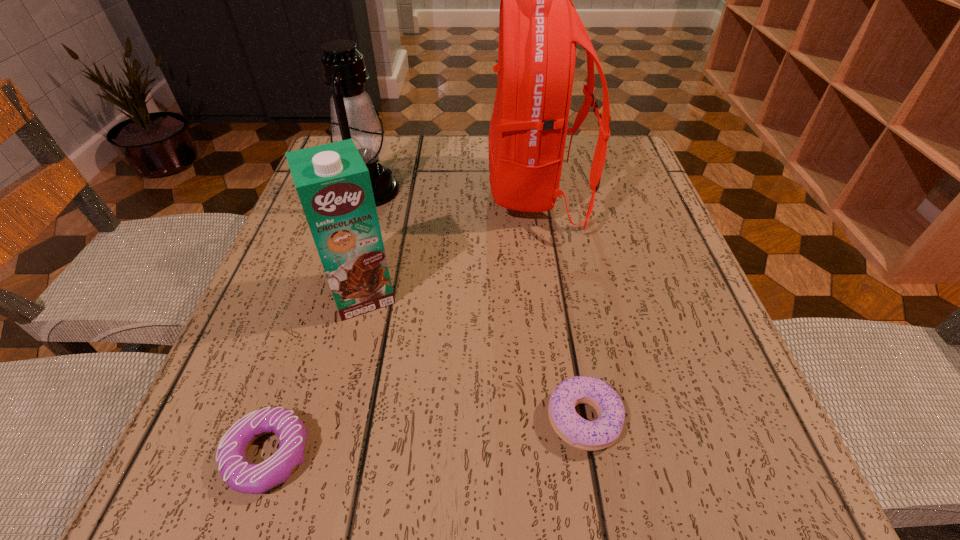
At what (x,y) coordinates should I click in order to perform the action: click on blank space located 0.080m on the left of the right doughnut. Please return your answer as a coordinate pair (x, y). The height and width of the screenshot is (540, 960). Looking at the image, I should click on (488, 419).

The height and width of the screenshot is (540, 960). What are the coordinates of `free space located on the right of the left doughnut` in the screenshot? It's located at (482, 455).

This screenshot has height=540, width=960. I want to click on backpack located at the far edge, so click(x=539, y=26).

You are a GUI agent. You are given a task and a screenshot of the screen. Output one action in this format:
    pyautogui.click(x=<x>, y=<y>)
    Task: Click on the oil lamp that is at the far edge
    This screenshot has height=540, width=960.
    Given the screenshot: What is the action you would take?
    pyautogui.click(x=353, y=115)

What are the coordinates of `oil lamp at the left edge` in the screenshot? It's located at (353, 115).

This screenshot has height=540, width=960. In order to click on carton located at the left edge in this screenshot , I will do `click(333, 183)`.

The height and width of the screenshot is (540, 960). I want to click on doughnut located in the left edge section of the desktop, so click(240, 475).

Locate an element on the screen. This screenshot has width=960, height=540. object that is at the right edge is located at coordinates (539, 26).

I want to click on object present at the far left corner, so click(x=353, y=115).

The height and width of the screenshot is (540, 960). What are the coordinates of `object at the near left corner` in the screenshot? It's located at (240, 475).